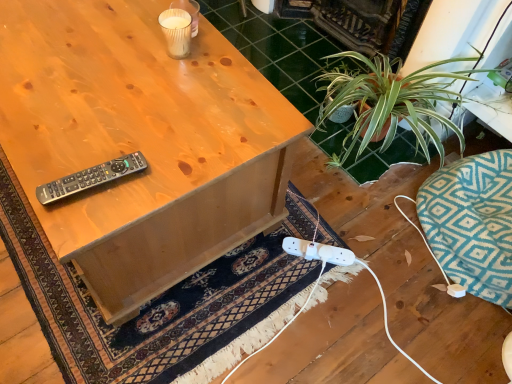
Question: Is matte wood desk at center taller than dark blue woven rug at lower center?

Choices:
 (A) no
 (B) yes

Answer: (B)

Question: Is matte wood desk at center to the left of dark blue woven rug at lower center from the viewer's perspective?

Choices:
 (A) no
 (B) yes

Answer: (B)

Question: Is matte wood desk at center in front of dark blue woven rug at lower center?

Choices:
 (A) yes
 (B) no

Answer: (A)

Question: Can you confirm if matte wood desk at center is thinner than dark blue woven rug at lower center?

Choices:
 (A) no
 (B) yes

Answer: (B)

Question: From a real-world perspective, does matte wood desk at center stand above dark blue woven rug at lower center?

Choices:
 (A) yes
 (B) no

Answer: (A)

Question: Does matte wood desk at center touch dark blue woven rug at lower center?

Choices:
 (A) no
 (B) yes

Answer: (A)

Question: Does matte wood desk at center lie behind black plastic remote at upper left?

Choices:
 (A) yes
 (B) no

Answer: (B)

Question: Can you confirm if matte wood desk at center is smaller than black plastic remote at upper left?

Choices:
 (A) yes
 (B) no

Answer: (B)

Question: Is matte wood desk at center turned away from black plastic remote at upper left?

Choices:
 (A) yes
 (B) no

Answer: (B)

Question: Is matte wood desk at center closer to camera compared to black plastic remote at upper left?

Choices:
 (A) yes
 (B) no

Answer: (A)

Question: Does matte wood desk at center have a lesser width compared to black plastic remote at upper left?

Choices:
 (A) yes
 (B) no

Answer: (B)

Question: Is the surface of matte wood desk at center in direct contact with black plastic remote at upper left?

Choices:
 (A) yes
 (B) no

Answer: (B)

Question: Considering the relative sizes of black plastic remote at upper left and matte wood desk at center in the image provided, is black plastic remote at upper left taller than matte wood desk at center?

Choices:
 (A) yes
 (B) no

Answer: (B)